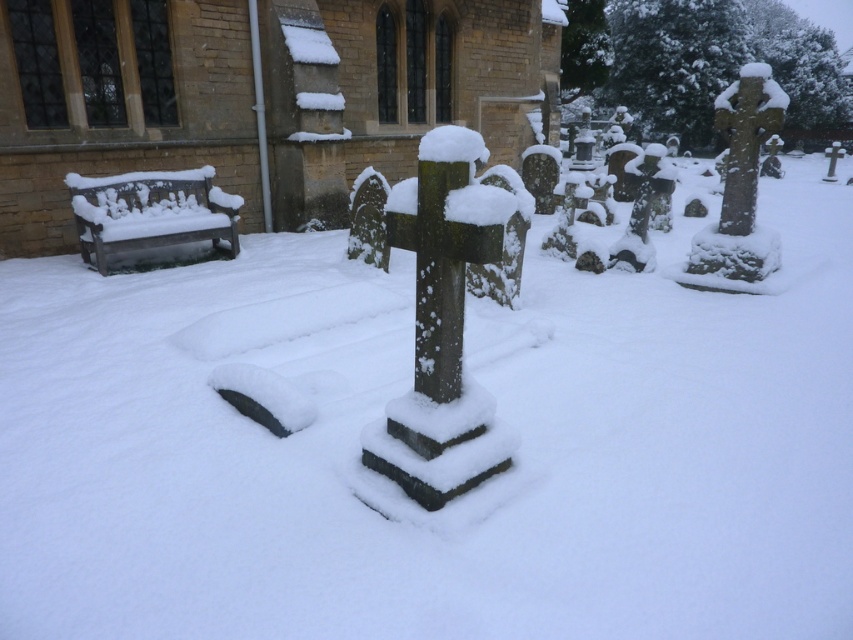
Question: Is brick textured church at left further to camera compared to green mossy stone cross at center?

Choices:
 (A) no
 (B) yes

Answer: (B)

Question: Is the position of brick textured church at left less distant than that of green mossy stone cross at center?

Choices:
 (A) no
 (B) yes

Answer: (A)

Question: Can you confirm if brick textured church at left is bigger than green mossy stone cross at center?

Choices:
 (A) no
 (B) yes

Answer: (B)

Question: Which point appears closest to the camera in this image?

Choices:
 (A) (508, 3)
 (B) (462, 456)

Answer: (B)

Question: Which point is closer to the camera taking this photo?

Choices:
 (A) (16, 122)
 (B) (422, 378)

Answer: (B)